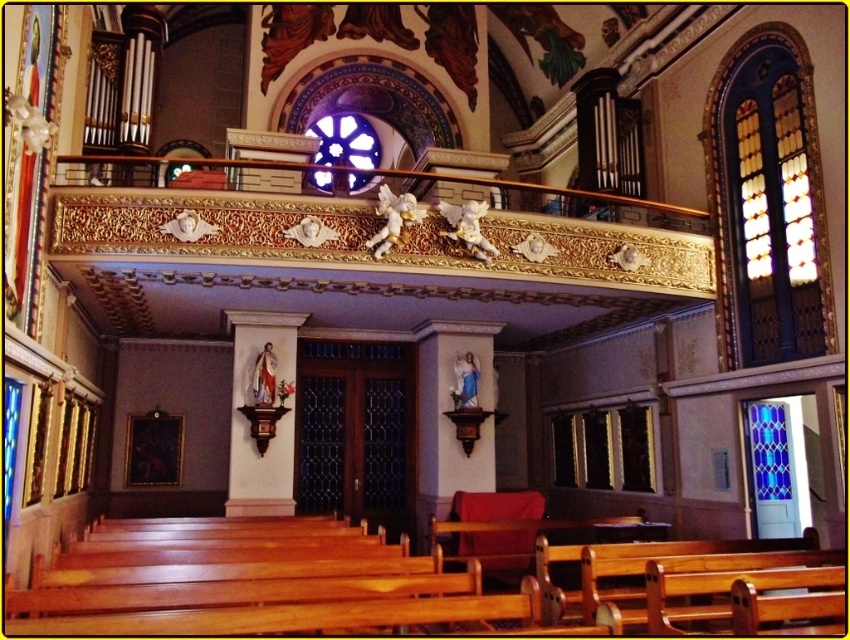
From the picture: Is stained glass at upper right taller than blue stained glass at right?

Yes.

Measure the distance between point (x=782, y=189) and camera.

Point (x=782, y=189) and camera are 14.08 meters apart.

Between point (772, 147) and point (786, 492), which one is positioned behind?

The point (786, 492) is more distant.

Find the location of `stained glass at upper right`. stained glass at upper right is located at coordinates (768, 202).

Which is above, blue stained glass at right or stained glass window at upper center?

stained glass window at upper center is above.

Does point (785, 500) come behind point (361, 132)?

No, (785, 500) is in front of (361, 132).

Identify the location of blue stained glass at right. The image size is (850, 640). (769, 451).

In the scene shown: Is stained glass at upper right further to camera compared to stained glass window at upper center?

That is False.

Between stained glass at upper right and stained glass window at upper center, which one has less height?

stained glass window at upper center is shorter.

Locate an element on the screen. The image size is (850, 640). stained glass at upper right is located at coordinates (768, 202).